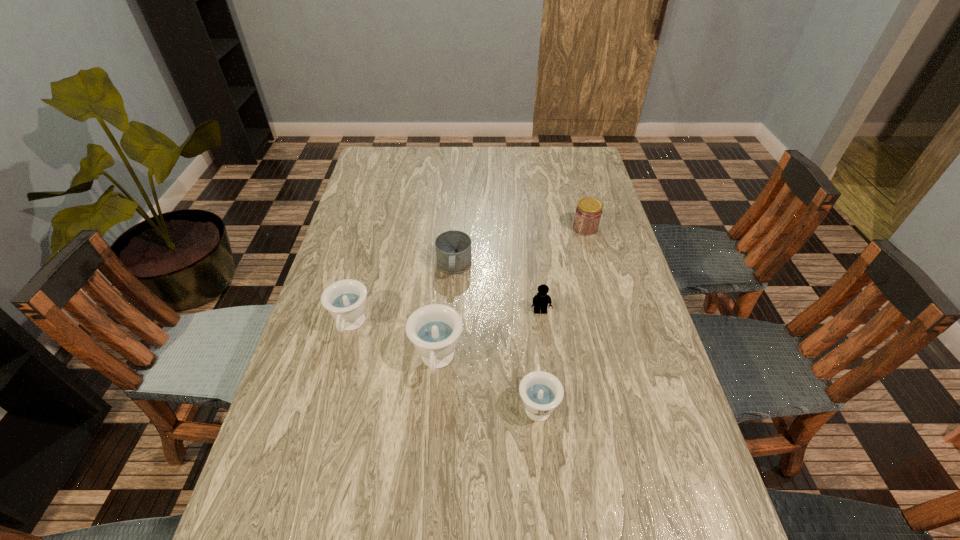
In order to click on vacant space located 0.240m on the side of the shortest teacup with the handle in this screenshot , I will do `click(527, 305)`.

Where is `vacant space located on the side of the shortest teacup with the handle`? The height and width of the screenshot is (540, 960). vacant space located on the side of the shortest teacup with the handle is located at coordinates (531, 343).

You are a GUI agent. You are given a task and a screenshot of the screen. Output one action in this format:
    pyautogui.click(x=<x>, y=<y>)
    Task: Click on the vacant space located on the side of the shortest teacup with the handle
    This screenshot has width=960, height=540.
    Given the screenshot: What is the action you would take?
    pyautogui.click(x=525, y=285)

This screenshot has width=960, height=540. I want to click on free space located on the front-facing side of the Lego, so click(550, 386).

The width and height of the screenshot is (960, 540). Find the location of `free space located on the front of the rightmost object`. free space located on the front of the rightmost object is located at coordinates (590, 246).

Locate an element on the screen. The height and width of the screenshot is (540, 960). vacant space positioned 0.160m on the side of the mug with the handle is located at coordinates [x=450, y=327].

The height and width of the screenshot is (540, 960). I want to click on object that is at the left edge, so coord(345,300).

You are a GUI agent. You are given a task and a screenshot of the screen. Output one action in this format:
    pyautogui.click(x=<x>, y=<y>)
    Task: Click on the object present at the right edge
    The image size is (960, 540).
    Given the screenshot: What is the action you would take?
    pyautogui.click(x=588, y=213)

Identify the location of vacant space at the far edge. This screenshot has height=540, width=960. (456, 158).

Locate an element on the screen. This screenshot has width=960, height=540. vacant space at the near edge of the desktop is located at coordinates (511, 485).